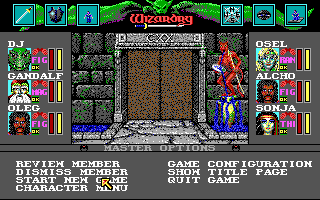
In order to click on horizontal stone door header in this screenshot , I will do `click(161, 45)`.